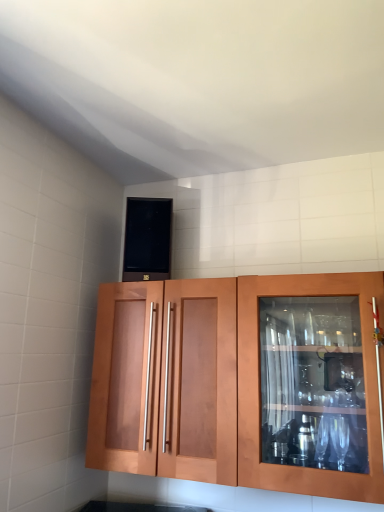
Question: From a real-world perspective, is matte wood cabinet at center physically above black matte speaker at upper center?

Choices:
 (A) yes
 (B) no

Answer: (B)

Question: From the image's perspective, does matte wood cabinet at center appear higher than black matte speaker at upper center?

Choices:
 (A) yes
 (B) no

Answer: (B)

Question: Is matte wood cabinet at center looking in the opposite direction of black matte speaker at upper center?

Choices:
 (A) yes
 (B) no

Answer: (B)

Question: Does matte wood cabinet at center have a lesser height compared to black matte speaker at upper center?

Choices:
 (A) yes
 (B) no

Answer: (B)

Question: From the image's perspective, is matte wood cabinet at center below black matte speaker at upper center?

Choices:
 (A) yes
 (B) no

Answer: (A)

Question: Can you confirm if matte wood cabinet at center is wider than black matte speaker at upper center?

Choices:
 (A) yes
 (B) no

Answer: (A)

Question: Is black matte speaker at upper center aimed at matte wood cabinet at center?

Choices:
 (A) yes
 (B) no

Answer: (B)

Question: Would you consider black matte speaker at upper center to be distant from matte wood cabinet at center?

Choices:
 (A) no
 (B) yes

Answer: (A)

Question: Considering the relative sizes of black matte speaker at upper center and matte wood cabinet at center in the image provided, is black matte speaker at upper center wider than matte wood cabinet at center?

Choices:
 (A) no
 (B) yes

Answer: (A)

Question: Does black matte speaker at upper center have a smaller size compared to matte wood cabinet at center?

Choices:
 (A) no
 (B) yes

Answer: (B)

Question: From a real-world perspective, is black matte speaker at upper center located higher than matte wood cabinet at center?

Choices:
 (A) no
 (B) yes

Answer: (B)

Question: From a real-world perspective, is black matte speaker at upper center physically below matte wood cabinet at center?

Choices:
 (A) yes
 (B) no

Answer: (B)

Question: Is matte wood cabinet at center situated inside black matte speaker at upper center or outside?

Choices:
 (A) outside
 (B) inside

Answer: (A)